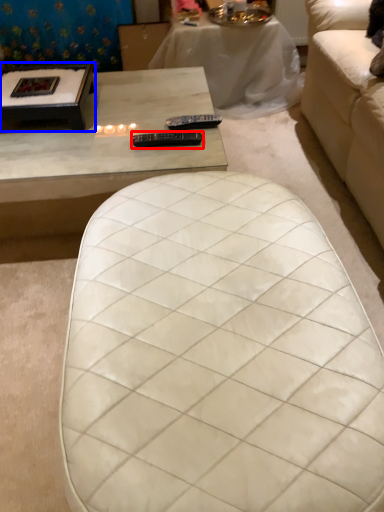
Question: Which point is further to the camera, remote (highlighted by a red box) or coffee table (highlighted by a blue box)?

Choices:
 (A) remote
 (B) coffee table

Answer: (B)